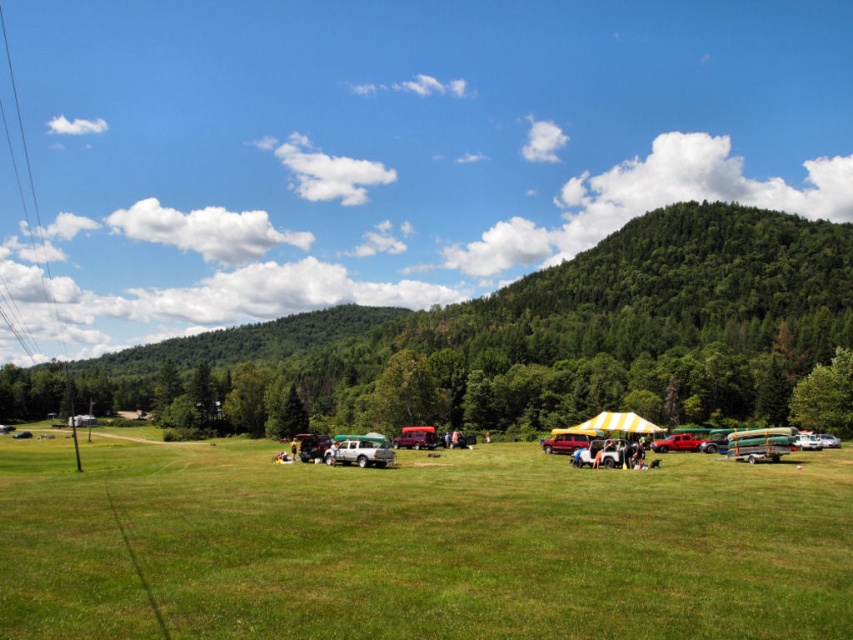
Is point (247, 481) closer to viewer compared to point (821, 316)?

Yes.

Is point (419, 572) farther from camera compared to point (830, 268)?

No, (419, 572) is in front of (830, 268).

You are a GUI agent. You are given a task and a screenshot of the screen. Output one action in this format:
    pyautogui.click(x=<x>, y=<y>)
    Task: Click on the green grassy field at center
    This screenshot has height=640, width=853.
    Given the screenshot: What is the action you would take?
    pyautogui.click(x=416, y=547)

Is green grassy field at center bigger than silver metallic truck at center?

Correct, green grassy field at center is larger in size than silver metallic truck at center.

Does green grassy field at center have a greater width compared to silver metallic truck at center?

Yes, green grassy field at center is wider than silver metallic truck at center.

Which is in front, point (39, 451) or point (345, 451)?

Point (345, 451)

Locate an element on the screen. The width and height of the screenshot is (853, 640). green grassy field at center is located at coordinates (416, 547).

Does green forested hill at center have a lesser height compared to silver metallic truck at center?

Incorrect, green forested hill at center's height does not fall short of silver metallic truck at center's.

Does green forested hill at center have a larger size compared to silver metallic truck at center?

Correct, green forested hill at center is larger in size than silver metallic truck at center.

Identify the location of green forested hill at center. Image resolution: width=853 pixels, height=640 pixels. (572, 328).

This screenshot has height=640, width=853. I want to click on green forested hill at center, so click(572, 328).